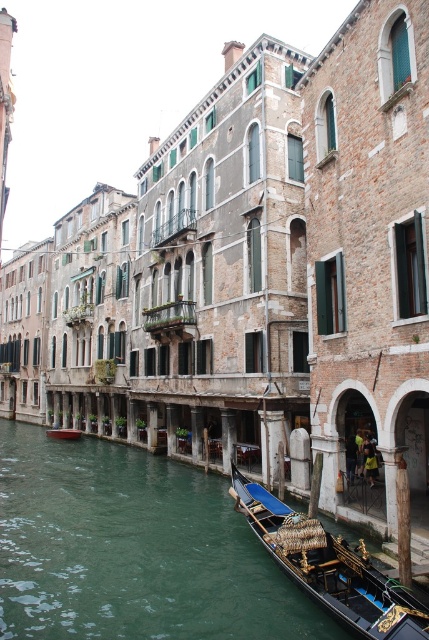
Question: Is black polished wood gondola at lower right to the right of wooden gondola at center from the viewer's perspective?

Choices:
 (A) no
 (B) yes

Answer: (B)

Question: Does black polished wood gondola at lower right have a lesser width compared to wooden gondola at center?

Choices:
 (A) no
 (B) yes

Answer: (A)

Question: Is black polished wood gondola at lower right wider than wooden gondola at center?

Choices:
 (A) yes
 (B) no

Answer: (A)